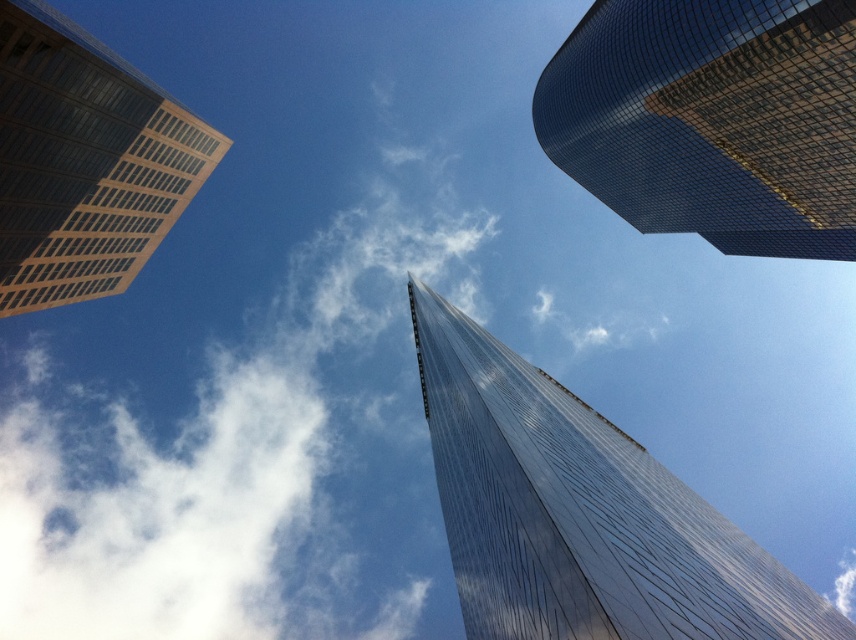
You are an architect reviewing a city blueprint and notice the white fluffy cloud at upper center and the glossy glass skyscraper at upper right. Which one has a larger physical size in the image?

The white fluffy cloud at upper center is bigger than the glossy glass skyscraper at upper right.